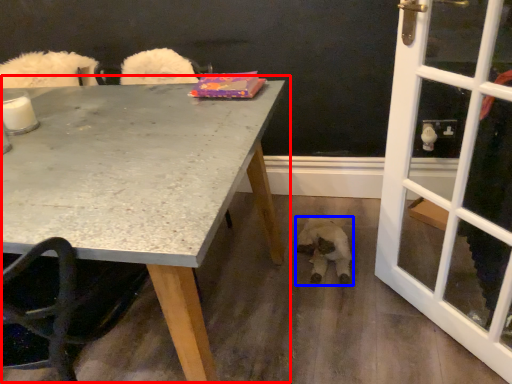
Question: Which object is further to the camera taking this photo, table (highlighted by a red box) or animal (highlighted by a blue box)?

Choices:
 (A) table
 (B) animal

Answer: (B)